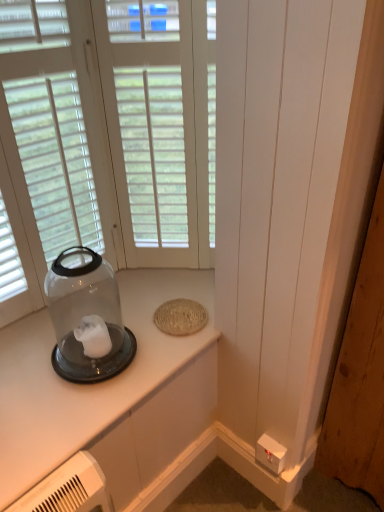
Question: Looking at their shapes, would you say clear glass jar at left is wider or thinner than transparent glass jar at left?

Choices:
 (A) thin
 (B) wide

Answer: (B)

Question: Considering the positions of clear glass jar at left and transparent glass jar at left in the image, is clear glass jar at left bigger or smaller than transparent glass jar at left?

Choices:
 (A) small
 (B) big

Answer: (A)

Question: Which is farther from the transparent glass jar at left?

Choices:
 (A) white wood window at center
 (B) white plastic electric outlet at lower right
 (C) clear glass jar at left

Answer: (B)

Question: Estimate the real-world distances between objects in this image. Which object is farther from the white plastic electric outlet at lower right?

Choices:
 (A) transparent glass jar at left
 (B) clear glass jar at left
 (C) white wood window at center

Answer: (C)